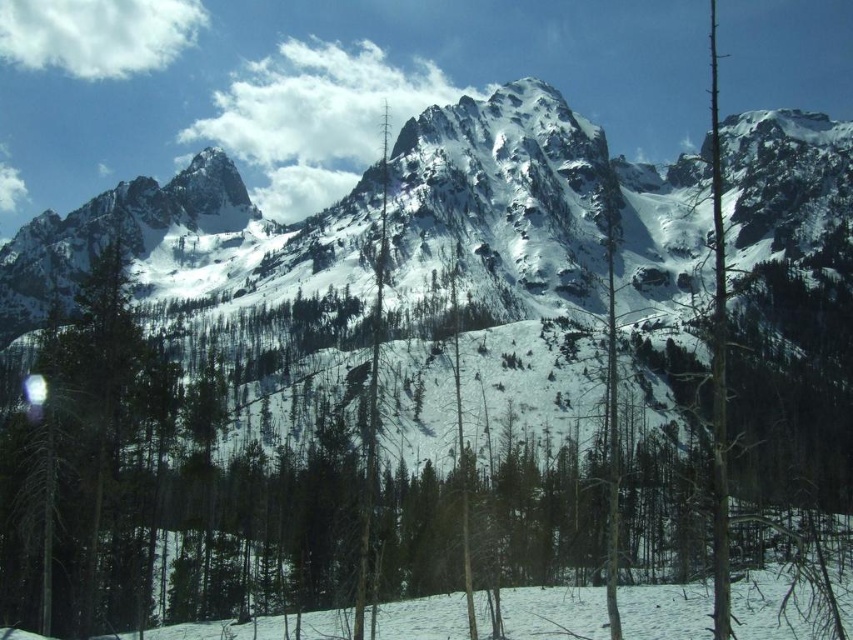
Is point (106, 212) farther from viewer compared to point (378, 352)?

That is True.

Which is behind, point (207, 168) or point (383, 104)?

The point (383, 104) is more distant.

Where is `white snow-covered mountain range at center`? The width and height of the screenshot is (853, 640). white snow-covered mountain range at center is located at coordinates (498, 200).